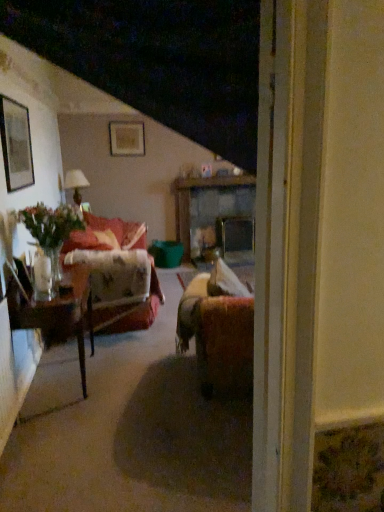
Question: Based on their sizes in the image, would you say wooden glossy table at left, acting as the 2th table starting from the right, is bigger or smaller than wooden table at center, acting as the first table starting from the top?

Choices:
 (A) big
 (B) small

Answer: (B)

Question: From the image's perspective, is wooden glossy table at left, the first table when ordered from front to back, above or below wooden table at center, which ranks as the 1th table in back-to-front order?

Choices:
 (A) below
 (B) above

Answer: (A)

Question: Considering the real-world distances, which object is farthest from the velvet red couch at left?

Choices:
 (A) wooden table at center, acting as the first table starting from the top
 (B) matte black picture frame at upper left, marked as the 2th picture frame in a back-to-front arrangement
 (C) wooden glossy table at left, acting as the 2th table starting from the right
 (D) matte gold picture frame at upper center, the 2th picture frame in the left-to-right sequence
 (E) matte white lampshade at left

Answer: (D)

Question: Which object is the closest to the wooden glossy table at left, which is the second table in back-to-front order?

Choices:
 (A) matte black picture frame at upper left, the 2th picture frame from the right
 (B) velvet red couch at left
 (C) matte gold picture frame at upper center, the 2th picture frame when ordered from bottom to top
 (D) matte white lampshade at left
 (E) wooden table at center, acting as the first table starting from the top

Answer: (A)